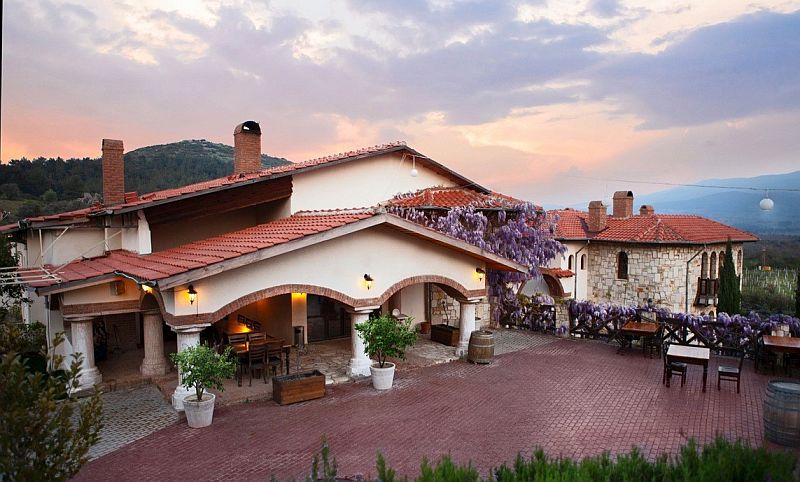
The width and height of the screenshot is (800, 482). I want to click on brown plant container, so click(x=298, y=394).